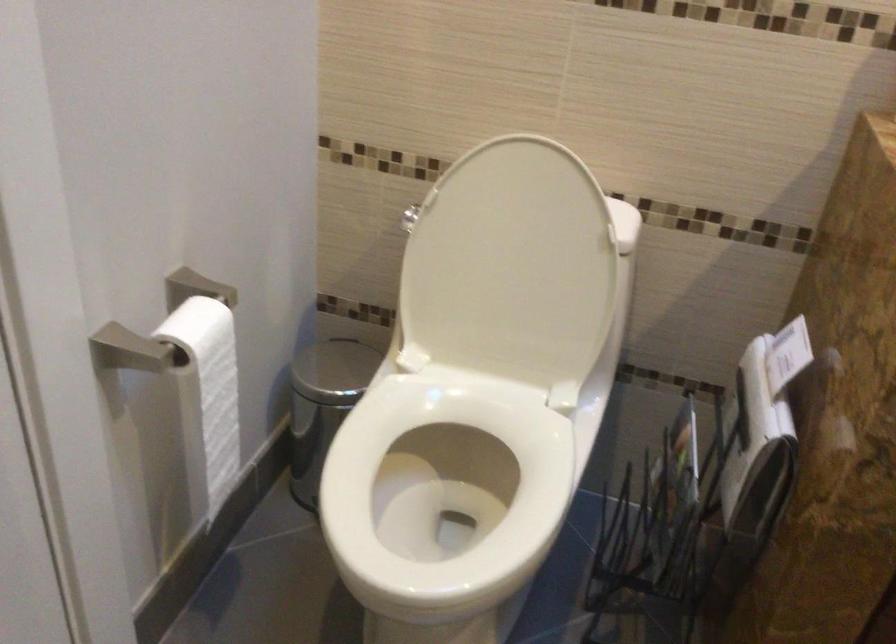
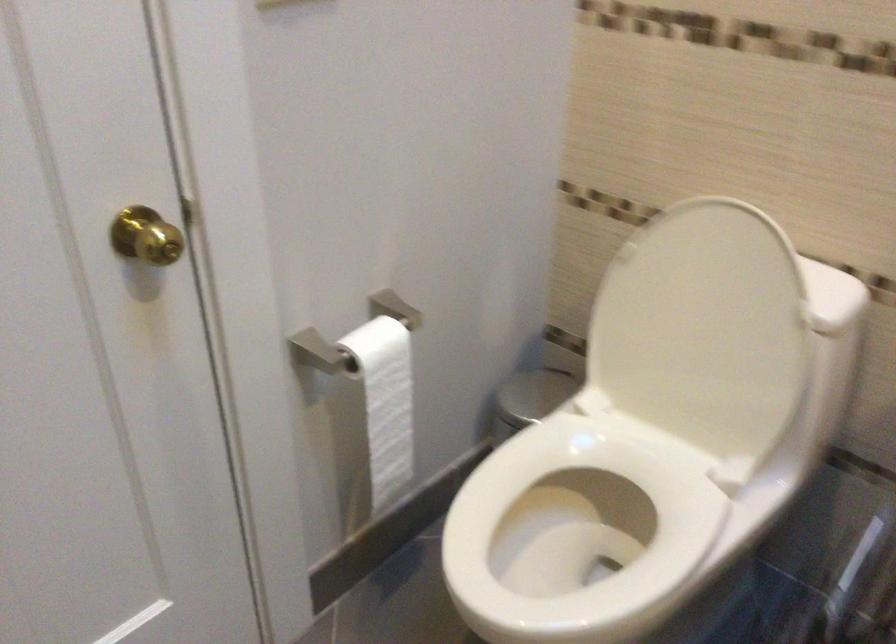
The point at (314, 371) is marked in the first image. Where is the corresponding point in the second image?

(532, 395)